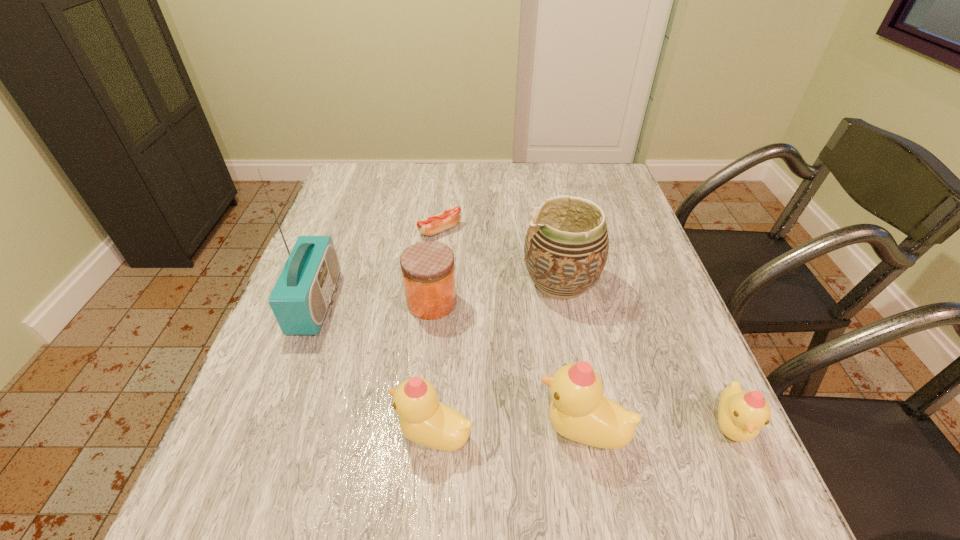
Observe the arrangement of all ducklings in the image. To keep them evenly spaced, where would you place another duckling on the left? Please locate a free space. Please provide its 2D coordinates. Your answer should be formatted as a tuple, i.e. [(x, y)], where the tuple contains the x and y coordinates of a point satisfying the conditions above.

[(281, 438)]